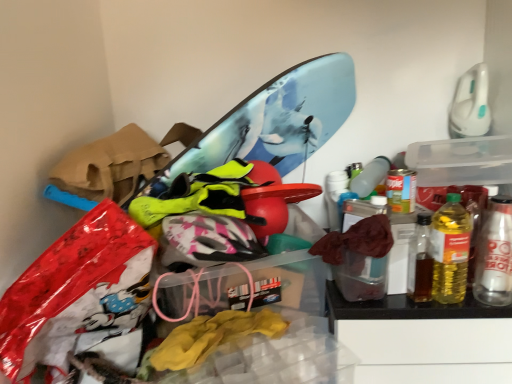
Question: Is translucent plastic bottle at right, the 1th bottle viewed from the left, to the left or to the right of metallic silver can at right, which appears as the 1th bottle when viewed from the right, in the image?

Choices:
 (A) left
 (B) right

Answer: (A)

Question: Considering the positions of translucent plastic bottle at right, the 1th bottle viewed from the left, and metallic silver can at right, which is the second bottle from left to right, in the image, is translucent plastic bottle at right, the 1th bottle viewed from the left, wider or thinner than metallic silver can at right, which is the second bottle from left to right,?

Choices:
 (A) wide
 (B) thin

Answer: (A)

Question: Which of these objects is positioned closest to the transparent plastic storage box at center, placed as the second storage box when sorted from top to bottom?

Choices:
 (A) metallic silver can at right, which is the second bottle from left to right
 (B) transparent plastic storage box at upper right, the second storage box from the bottom
 (C) translucent plastic bottle at right, the 2th bottle in the right-to-left sequence

Answer: (C)

Question: Which object is positioned closest to the transparent plastic storage box at center, which is the 2th storage box from right to left?

Choices:
 (A) transparent plastic storage box at upper right, arranged as the 2th storage box when viewed from the left
 (B) translucent plastic bottle at right, the 1th bottle viewed from the left
 (C) metallic silver can at right, which appears as the 1th bottle when viewed from the right

Answer: (B)